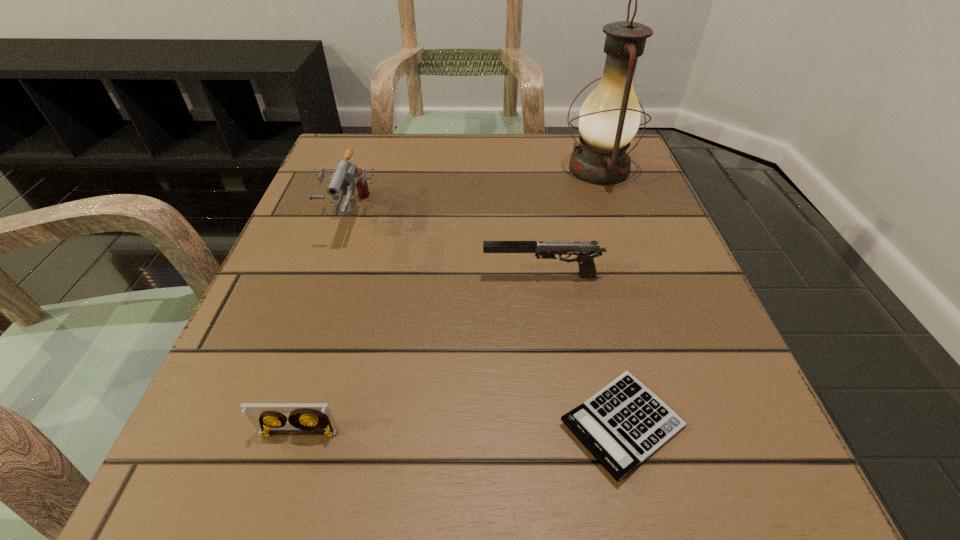
Where is `free space located 0.340m at the muzzle end of the third nearest object`? free space located 0.340m at the muzzle end of the third nearest object is located at coordinates (279, 276).

Identify the location of vacant region located 0.180m at the muzzle end of the third nearest object. The image size is (960, 540). (375, 276).

Locate an element on the screen. This screenshot has height=540, width=960. free point located 0.060m at the front of the videotape with visible reels is located at coordinates (282, 488).

I want to click on free space located on the back of the shortest object, so click(x=596, y=317).

You are a GUI agent. You are given a task and a screenshot of the screen. Output one action in this format:
    pyautogui.click(x=<x>, y=<y>)
    Task: Click on the object that is at the far edge
    
    Given the screenshot: What is the action you would take?
    pyautogui.click(x=609, y=118)

At what (x,y) coordinates should I click in order to perform the action: click on object present at the near edge. Please return your answer as a coordinate pair (x, y). Image resolution: width=960 pixels, height=540 pixels. Looking at the image, I should click on (623, 424).

You are a GUI agent. You are given a task and a screenshot of the screen. Output one action in this format:
    pyautogui.click(x=<x>, y=<y>)
    Task: Click on the gun that is at the left edge
    
    Given the screenshot: What is the action you would take?
    pyautogui.click(x=346, y=174)

This screenshot has width=960, height=540. Identify the location of videotape that is at the left edge. (305, 418).

Locate an element on the screen. This screenshot has width=960, height=540. oil lamp that is at the right edge is located at coordinates (609, 118).

In order to click on gun that is at the right edge in this screenshot , I will do (x=586, y=251).